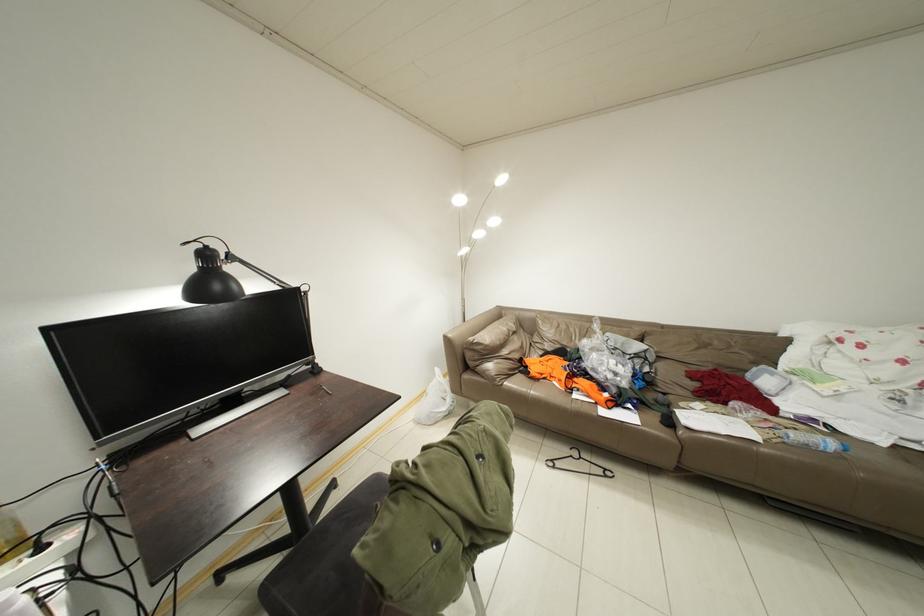
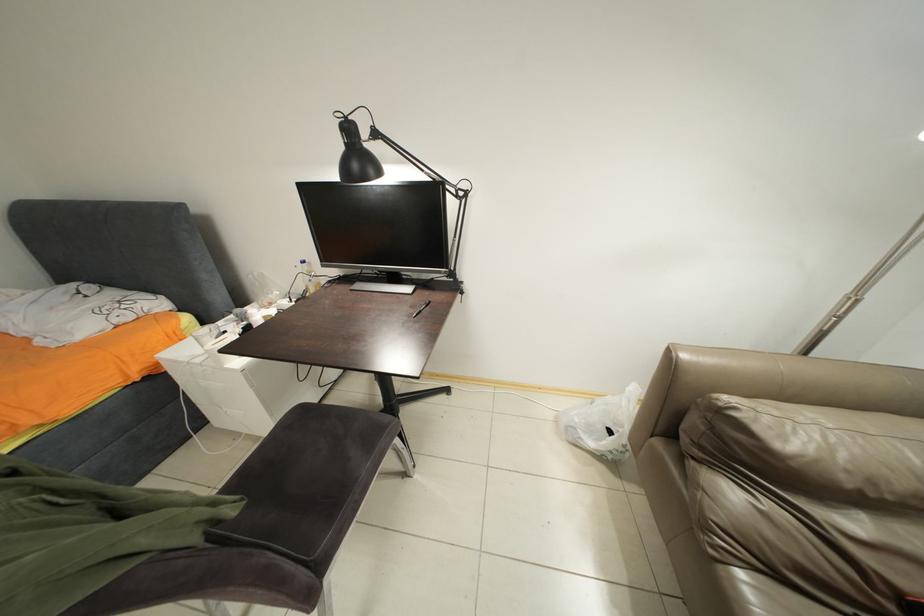
How did the camera likely rotate?

The camera's rotation is toward left-down.